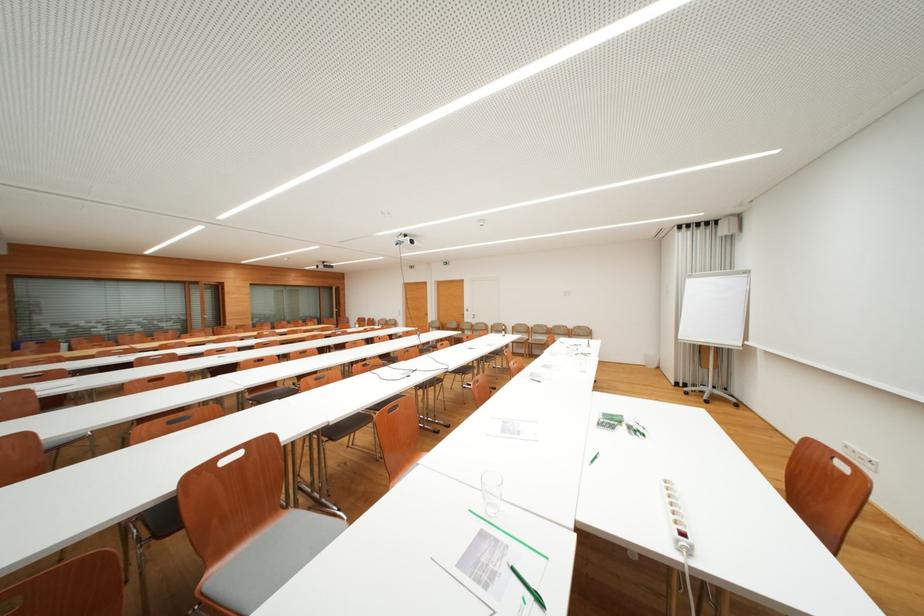
The width and height of the screenshot is (924, 616). Describe the element at coordinates (473, 317) in the screenshot. I see `the metal door handle` at that location.